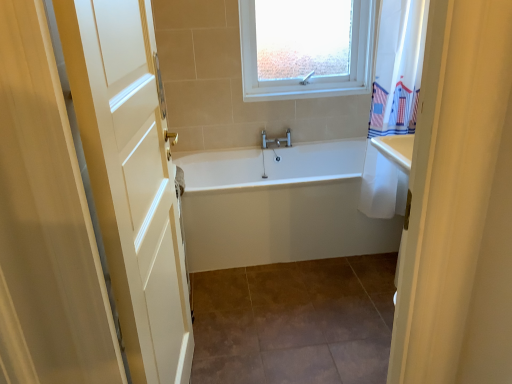
Question: Is white glossy bathtub at center at the right side of white wood door at left?

Choices:
 (A) no
 (B) yes

Answer: (B)

Question: Is white glossy bathtub at center to the left of white wood door at left from the viewer's perspective?

Choices:
 (A) no
 (B) yes

Answer: (A)

Question: Does white glossy bathtub at center have a lesser width compared to white wood door at left?

Choices:
 (A) no
 (B) yes

Answer: (A)

Question: Is white glossy bathtub at center positioned before white wood door at left?

Choices:
 (A) yes
 (B) no

Answer: (B)

Question: Are white glossy bathtub at center and white wood door at left far apart?

Choices:
 (A) no
 (B) yes

Answer: (A)

Question: Can you confirm if white glossy bathtub at center is shorter than white wood door at left?

Choices:
 (A) no
 (B) yes

Answer: (B)

Question: Is white glossy bathtub at center at the right side of brown tile at center?

Choices:
 (A) yes
 (B) no

Answer: (B)

Question: Would you say white glossy bathtub at center is a long distance from brown tile at center?

Choices:
 (A) no
 (B) yes

Answer: (A)

Question: Considering the relative sizes of white glossy bathtub at center and brown tile at center in the image provided, is white glossy bathtub at center smaller than brown tile at center?

Choices:
 (A) no
 (B) yes

Answer: (A)

Question: Is white glossy bathtub at center turned away from brown tile at center?

Choices:
 (A) no
 (B) yes

Answer: (A)

Question: Does white glossy bathtub at center have a lesser width compared to brown tile at center?

Choices:
 (A) no
 (B) yes

Answer: (B)

Question: Is white glossy bathtub at center located outside brown tile at center?

Choices:
 (A) yes
 (B) no

Answer: (A)

Question: Is brown tile at center wider than white wood door at left?

Choices:
 (A) no
 (B) yes

Answer: (B)